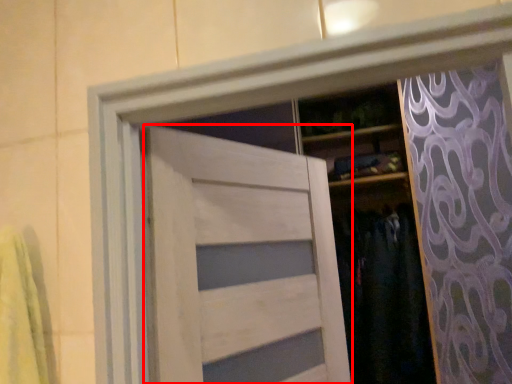
Question: Considering the relative positions of door (annotated by the red box) and clothing in the image provided, where is door (annotated by the red box) located with respect to the staircase?

Choices:
 (A) left
 (B) right

Answer: (A)